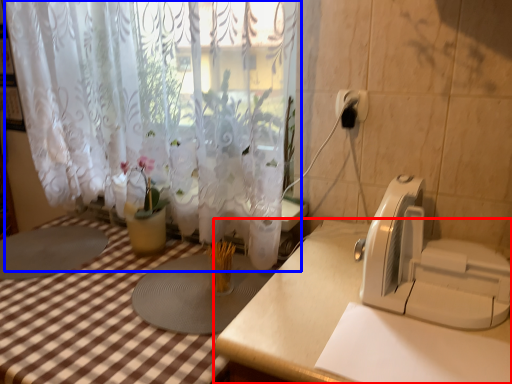
Question: Which object appears farthest to the camera in this image, table (highlighted by a red box) or curtain (highlighted by a blue box)?

Choices:
 (A) table
 (B) curtain

Answer: (B)